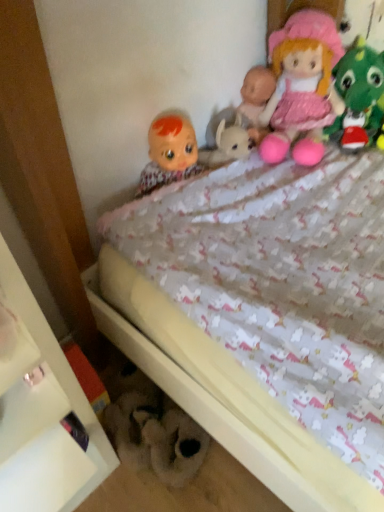
Question: Is matte plastic doll at upper left, the first doll in the left-to-right sequence, taller than white glossy shelf at lower left?

Choices:
 (A) yes
 (B) no

Answer: (B)

Question: Is matte plastic doll at upper left, the 2th doll viewed from the right, far from white glossy shelf at lower left?

Choices:
 (A) no
 (B) yes

Answer: (A)

Question: From a real-world perspective, is matte plastic doll at upper left, the first doll in the left-to-right sequence, on top of white glossy shelf at lower left?

Choices:
 (A) yes
 (B) no

Answer: (A)

Question: Are matte plastic doll at upper left, the first doll in the left-to-right sequence, and white glossy shelf at lower left making contact?

Choices:
 (A) no
 (B) yes

Answer: (A)

Question: Is matte plastic doll at upper left, the first doll in the left-to-right sequence, outside white glossy shelf at lower left?

Choices:
 (A) no
 (B) yes

Answer: (B)

Question: Is fluffy white teddy bear at lower center, the first toy ordered from the bottom, situated inside white glossy shelf at lower left or outside?

Choices:
 (A) outside
 (B) inside

Answer: (A)

Question: Would you say fluffy white teddy bear at lower center, the second toy positioned from the top, is to the left or to the right of white glossy shelf at lower left in the picture?

Choices:
 (A) left
 (B) right

Answer: (B)

Question: From a real-world perspective, is fluffy white teddy bear at lower center, the first toy ordered from the bottom, physically located above or below white glossy shelf at lower left?

Choices:
 (A) above
 (B) below

Answer: (B)

Question: Considering the positions of point [x=147, y=403] and point [x=24, y=497], is point [x=147, y=403] closer or farther from the camera than point [x=24, y=497]?

Choices:
 (A) farther
 (B) closer

Answer: (A)

Question: Based on their positions, is white glossy shelf at lower left located to the left or right of pink fabric doll at upper right, which appears as the second toy when viewed from the left?

Choices:
 (A) left
 (B) right

Answer: (A)

Question: Is white glossy shelf at lower left wider or thinner than pink fabric doll at upper right, which is counted as the 1th toy, starting from the right?

Choices:
 (A) wide
 (B) thin

Answer: (A)

Question: From the image's perspective, is white glossy shelf at lower left above or below pink fabric doll at upper right, the second toy when ordered from bottom to top?

Choices:
 (A) above
 (B) below

Answer: (B)

Question: Is white glossy shelf at lower left inside the boundaries of pink fabric doll at upper right, the 1th toy from the top, or outside?

Choices:
 (A) outside
 (B) inside

Answer: (A)

Question: From a real-world perspective, is matte plastic doll at upper left, the first doll in the left-to-right sequence, physically located above or below pink fabric doll at upper right, which is counted as the 1th doll, starting from the right?

Choices:
 (A) below
 (B) above

Answer: (A)

Question: Looking at the image, does matte plastic doll at upper left, the 2th doll viewed from the right, seem bigger or smaller compared to pink fabric doll at upper right, placed as the second doll when sorted from left to right?

Choices:
 (A) big
 (B) small

Answer: (B)